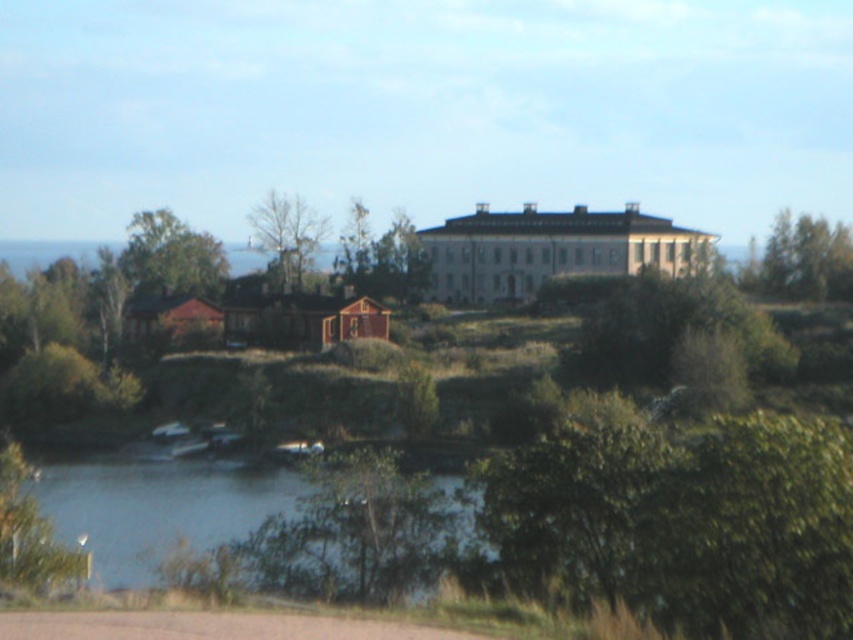
Question: Which point is closer to the camera?

Choices:
 (A) white stone palace at center
 (B) bare wood tree at center
 (C) green leafy tree at upper left
 (D) green leafy tree at lower left

Answer: (D)

Question: Can you confirm if green leafy tree at upper right is smaller than bare wood tree at center?

Choices:
 (A) no
 (B) yes

Answer: (A)

Question: Does white stone palace at center have a larger size compared to green leafy tree at upper left?

Choices:
 (A) yes
 (B) no

Answer: (B)

Question: Is white stone palace at center closer to camera compared to green leafy tree at lower left?

Choices:
 (A) no
 (B) yes

Answer: (A)

Question: Which point is closer to the camera?

Choices:
 (A) (16, 573)
 (B) (142, 556)
 (C) (505, 296)
 (D) (821, 275)

Answer: (A)

Question: Estimate the real-world distances between objects in this image. Which object is farther from the white stone palace at center?

Choices:
 (A) clear water at lower left
 (B) green leafy tree at upper right
 (C) green leafy tree at lower left

Answer: (C)